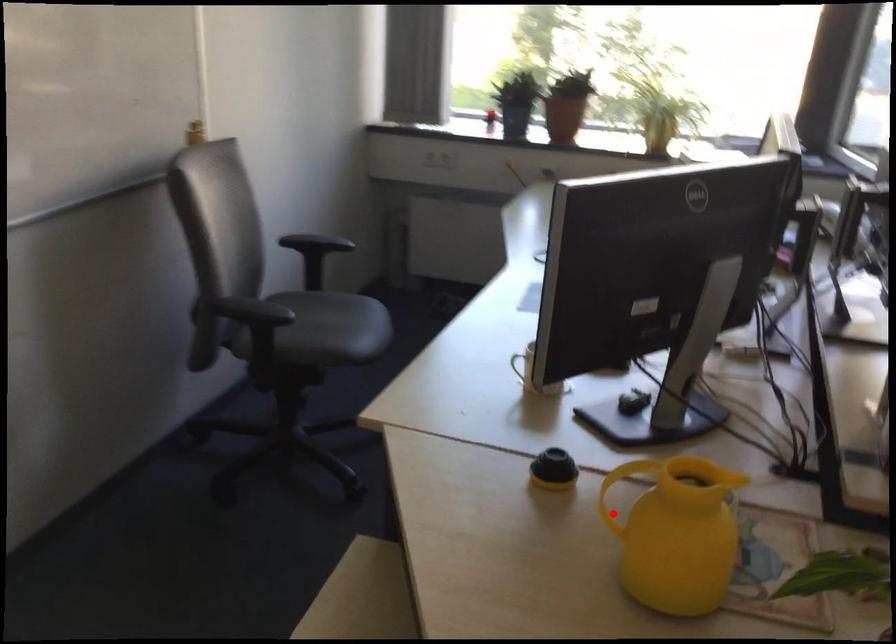
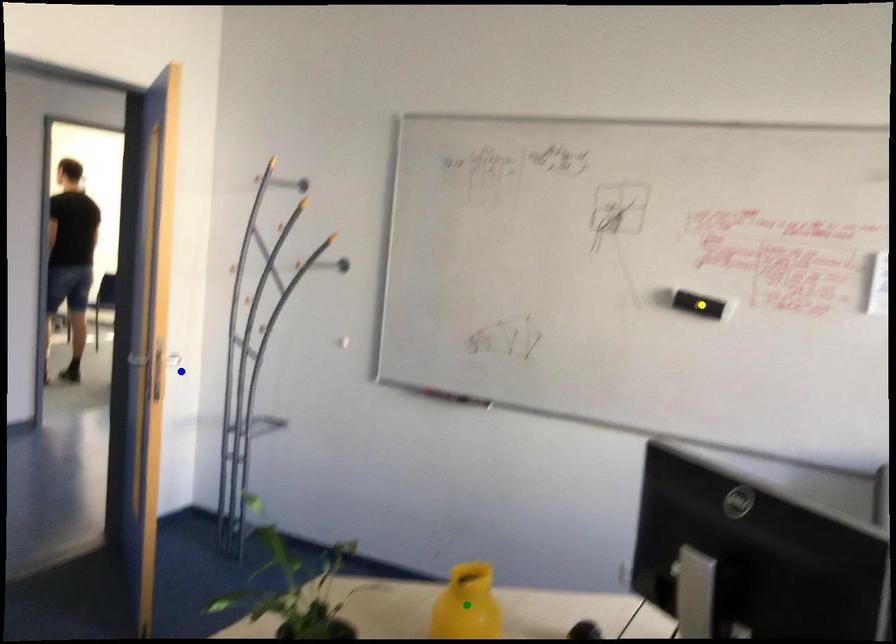
Question: I am providing you with two images of the same scene from different viewpoints. A red point is marked on the first image. You are given multiple points on the second image. Can you choose the point in image 2 that corresponds to the point in image 1?

Choices:
 (A) blue point
 (B) green point
 (C) yellow point

Answer: (B)